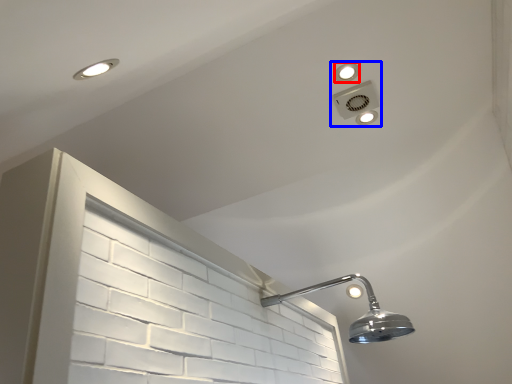
Question: Among these objects, which one is nearest to the camera, dot (highlighted by a red box) or fixture (highlighted by a blue box)?

Choices:
 (A) dot
 (B) fixture

Answer: (A)